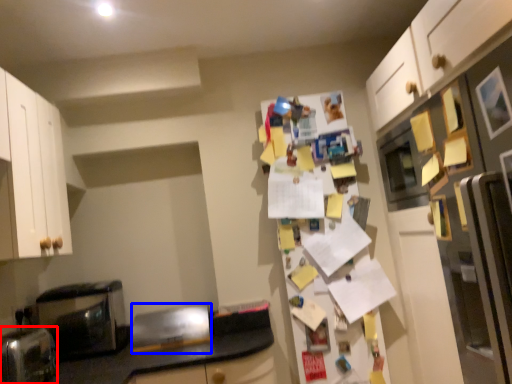
Question: Which object is further to the camera taking this photo, appliance (highlighted by a red box) or appliance (highlighted by a blue box)?

Choices:
 (A) appliance
 (B) appliance

Answer: (B)